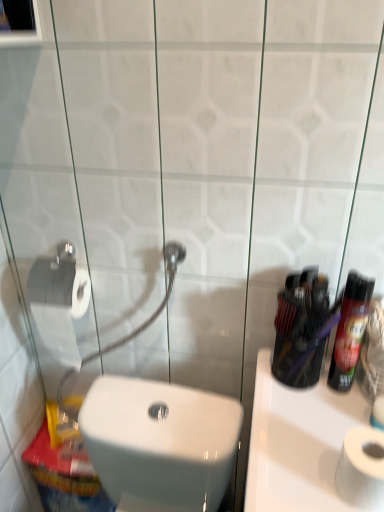
The width and height of the screenshot is (384, 512). What are the coordinates of `free space in front of shiny black spray can at right` in the screenshot? It's located at (314, 438).